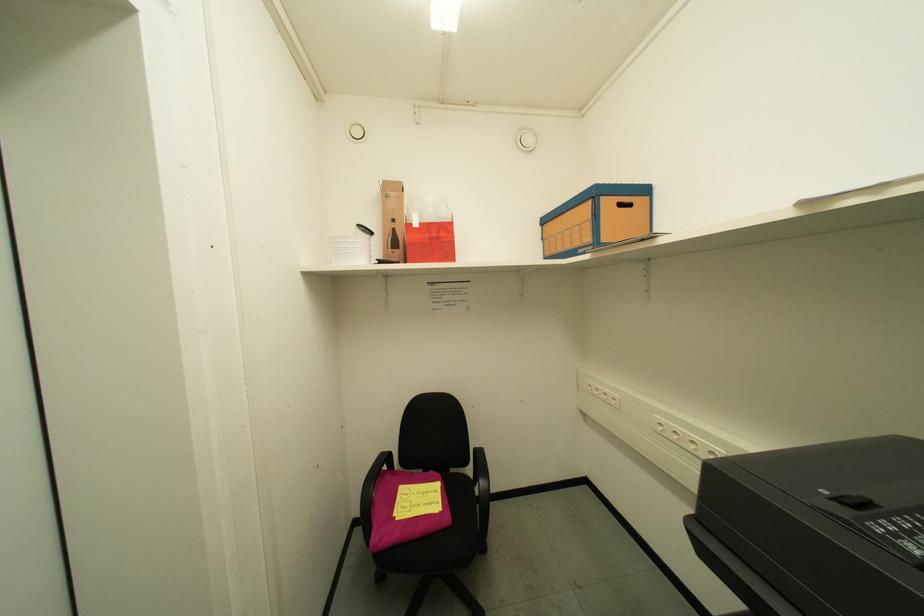
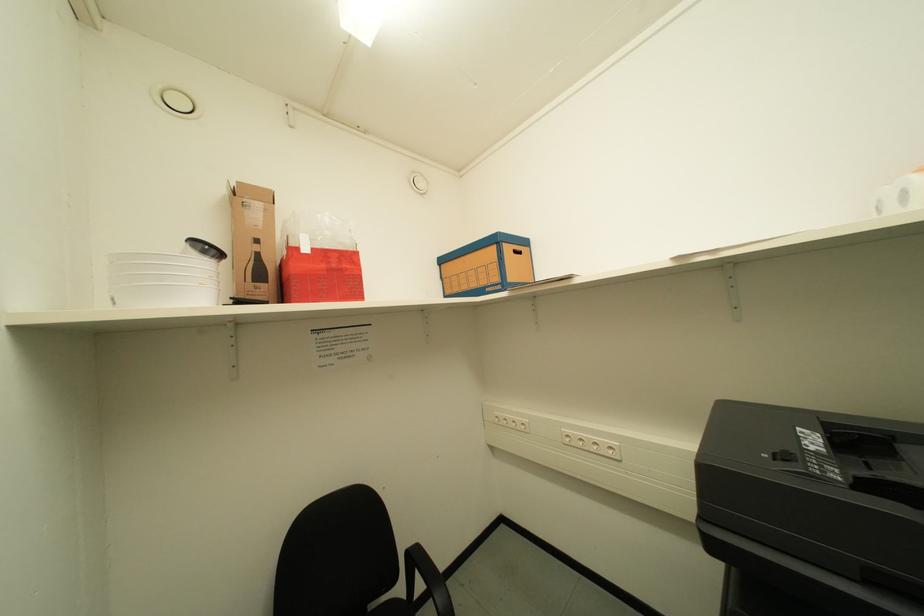
Question: The camera is either moving clockwise (left) or counter-clockwise (right) around the object. The first image is from the beginning of the video and the second image is from the end. Is the camera moving left or right when shooting the video?

Choices:
 (A) Left
 (B) Right

Answer: (A)